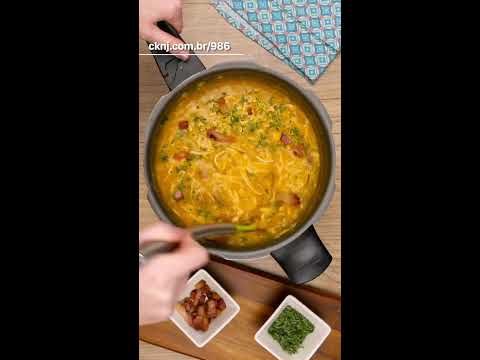
In order to click on white square bowl bottom right in this screenshot , I will do `click(317, 341)`.